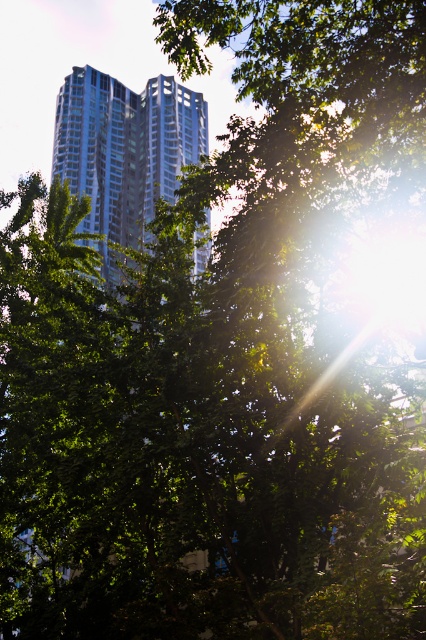
Is glassy reflective building at center to the right of glassy silver skyscraper at center from the viewer's perspective?

Incorrect, glassy reflective building at center is not on the right side of glassy silver skyscraper at center.

Is glassy reflective building at center below glassy silver skyscraper at center?

Yes.

Where is `glassy reflective building at center`? This screenshot has width=426, height=640. glassy reflective building at center is located at coordinates (124, 150).